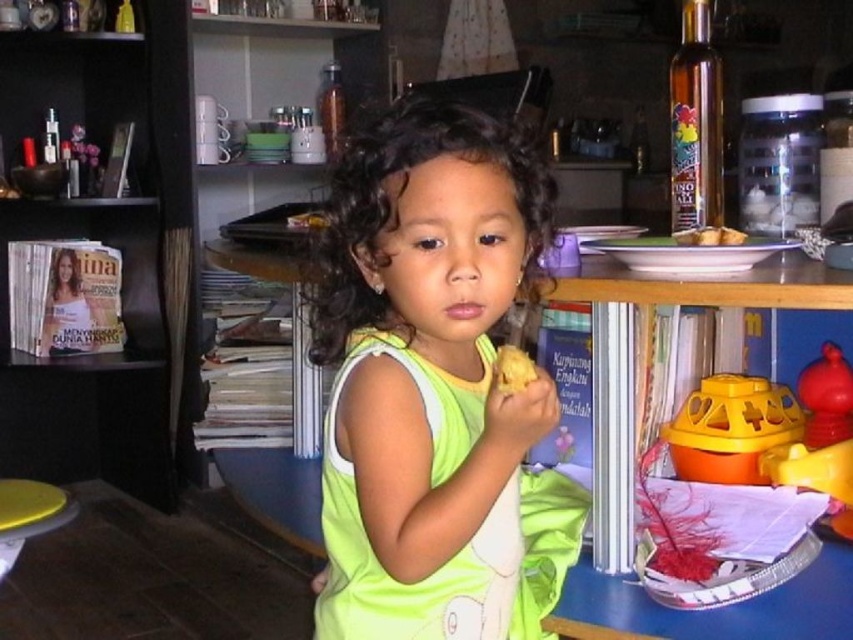
Question: Which of the following is the farthest from the observer?

Choices:
 (A) (764, 452)
 (B) (113, 436)

Answer: (B)

Question: Considering the real-world distances, which object is closest to the green fabric dress at center?

Choices:
 (A) black wood bookshelf at left
 (B) golden brown bread at right
 (C) rubberized red toy at right

Answer: (B)

Question: Is the position of green fabric dress at center less distant than that of black wood bookshelf at left?

Choices:
 (A) yes
 (B) no

Answer: (A)

Question: Which point appears farthest from the camera in this image?

Choices:
 (A) (3, 499)
 (B) (505, 380)

Answer: (A)

Question: Is smooth yellow stool at lower left positioned in front of yellow crumbly bread at center?

Choices:
 (A) yes
 (B) no

Answer: (B)

Question: Is yellow plastic toy at right bigger than rubberized red toy at right?

Choices:
 (A) yes
 (B) no

Answer: (B)